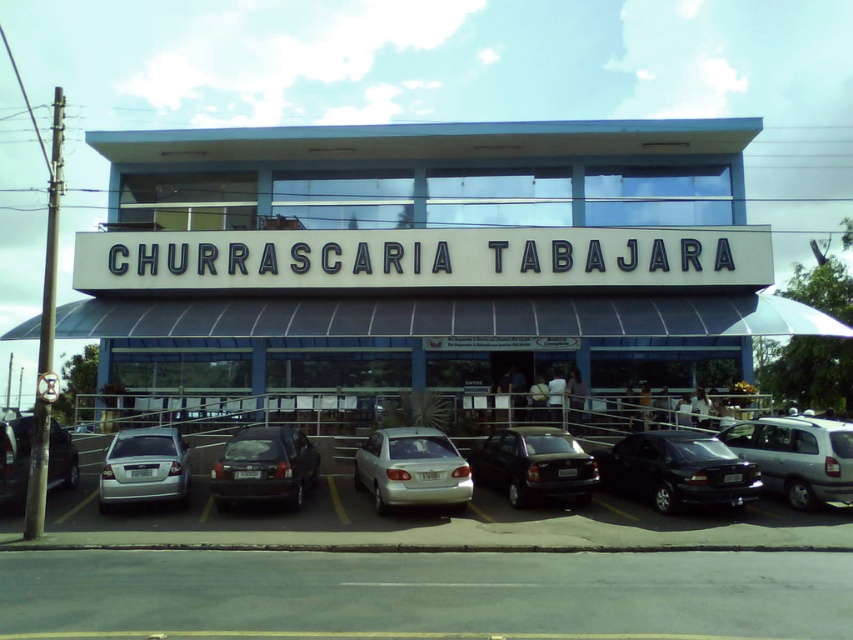
You are a delivery driver arriving at Churrascaria Tabajara. You need to park your vehicle but there are only two spots available. You see a satin black hatchback at center and a silver metallic sedan at lower left. Which vehicle is blocking the parking spot closest to the restaurant entrance?

The silver metallic sedan at lower left is blocking the parking spot closest to the restaurant entrance because it is positioned behind the satin black hatchback at center, meaning it is further away from the entrance.

You are standing at the entrance of the restaurant and want to find the black matte car at lower center. Based on the coordinates provided in the Objects Description, can you determine its position relative to the entrance?

The black matte car at lower center is located at point coordinates of (677, 470), which places it in the lower central area of the image, near the parking section closest to the entrance.